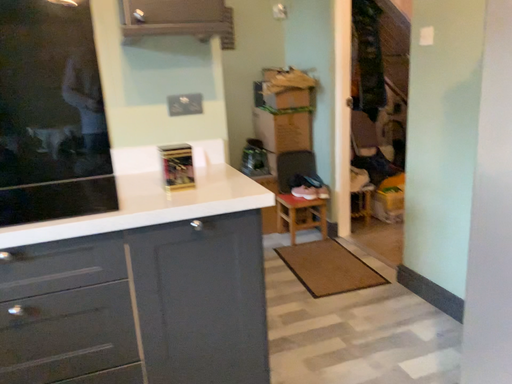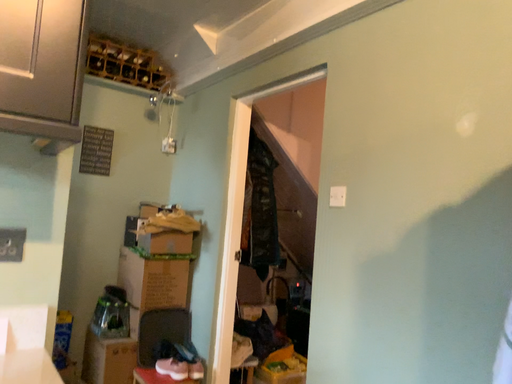
Question: How did the camera likely rotate when shooting the video?

Choices:
 (A) rotated right
 (B) rotated left

Answer: (A)